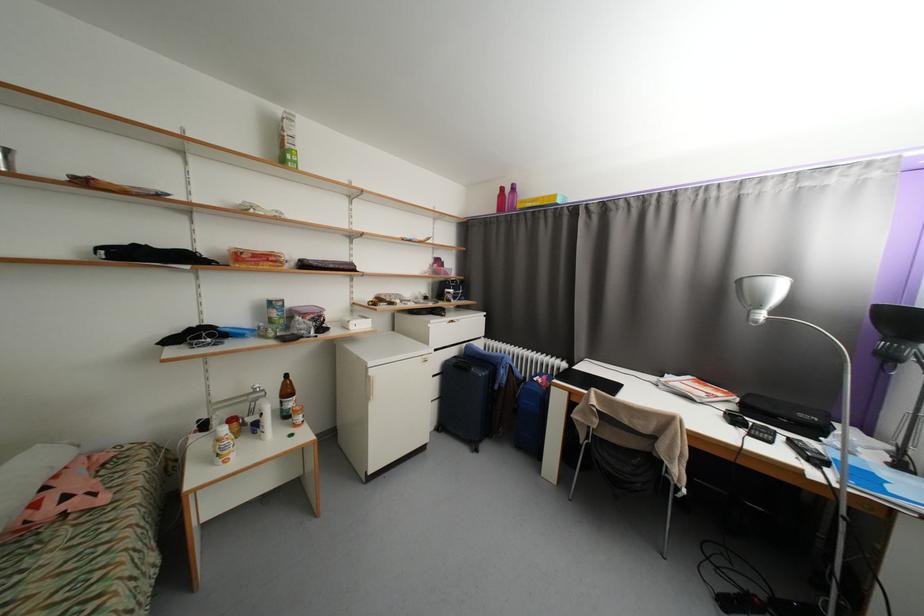
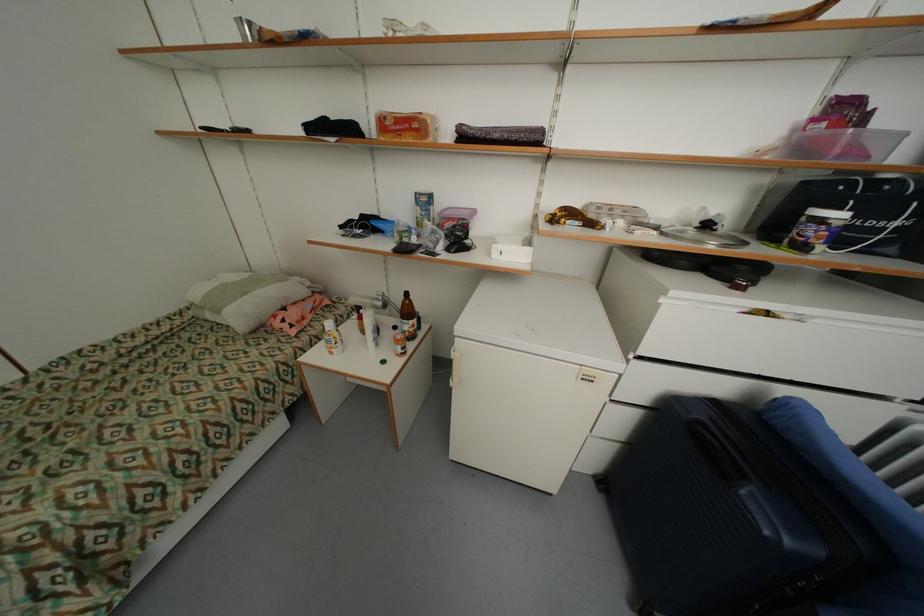
In the second image, find the point that corresponds to point 280,260 in the first image.

(421, 126)